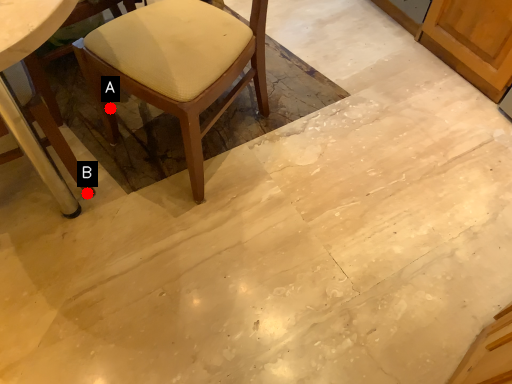
Question: Two points are circled on the image, labeled by A and B beside each circle. Which point is farther to the camera?

Choices:
 (A) A is further
 (B) B is further

Answer: (A)